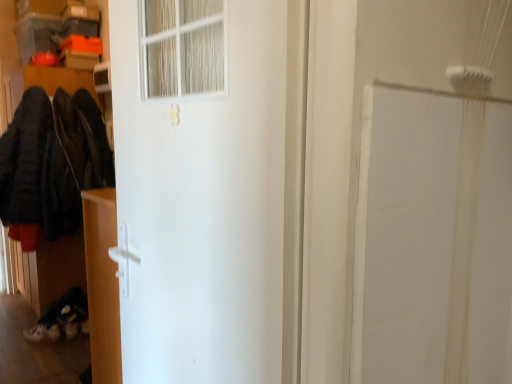
Question: From a real-world perspective, is matte white cabinet at lower left located beneath dark woolen coat at left?

Choices:
 (A) no
 (B) yes

Answer: (B)

Question: From the image's perspective, is matte white cabinet at lower left below dark woolen coat at left?

Choices:
 (A) no
 (B) yes

Answer: (B)

Question: Can we say matte white cabinet at lower left lies outside dark woolen coat at left?

Choices:
 (A) no
 (B) yes

Answer: (B)

Question: Is matte white cabinet at lower left facing towards dark woolen coat at left?

Choices:
 (A) yes
 (B) no

Answer: (B)

Question: Can you confirm if matte white cabinet at lower left is thinner than dark woolen coat at left?

Choices:
 (A) no
 (B) yes

Answer: (B)

Question: Is matte white cabinet at lower left positioned with its back to dark woolen coat at left?

Choices:
 (A) yes
 (B) no

Answer: (B)

Question: Does dark woolen coat at left have a greater height compared to white matte door at center?

Choices:
 (A) no
 (B) yes

Answer: (A)

Question: Is dark woolen coat at left next to white matte door at center and touching it?

Choices:
 (A) yes
 (B) no

Answer: (B)

Question: Considering the relative sizes of dark woolen coat at left and white matte door at center in the image provided, is dark woolen coat at left bigger than white matte door at center?

Choices:
 (A) no
 (B) yes

Answer: (B)

Question: Is white matte door at center surrounded by dark woolen coat at left?

Choices:
 (A) yes
 (B) no

Answer: (B)

Question: From the image's perspective, is dark woolen coat at left under white matte door at center?

Choices:
 (A) yes
 (B) no

Answer: (B)

Question: From the image's perspective, would you say dark woolen coat at left is positioned over white matte door at center?

Choices:
 (A) yes
 (B) no

Answer: (A)

Question: Is the surface of white matte door at center in direct contact with matte white cabinet at lower left?

Choices:
 (A) yes
 (B) no

Answer: (B)